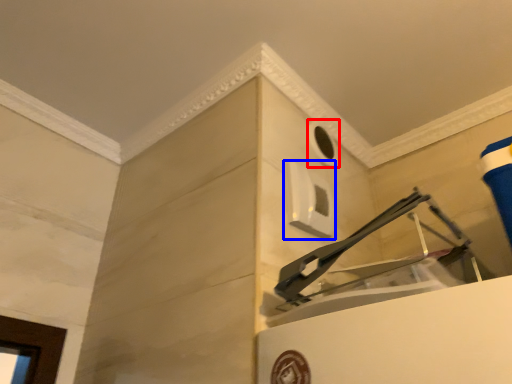
Question: Which object is further to the camera taking this photo, hole (highlighted by a red box) or window (highlighted by a blue box)?

Choices:
 (A) hole
 (B) window

Answer: (A)